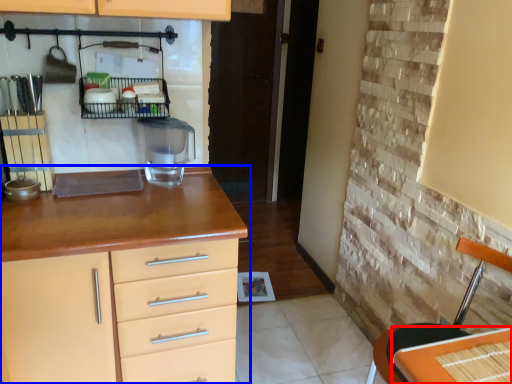
Question: Which object appears closest to the camera in this image, table (highlighted by a red box) or chest of drawers (highlighted by a blue box)?

Choices:
 (A) table
 (B) chest of drawers

Answer: (A)